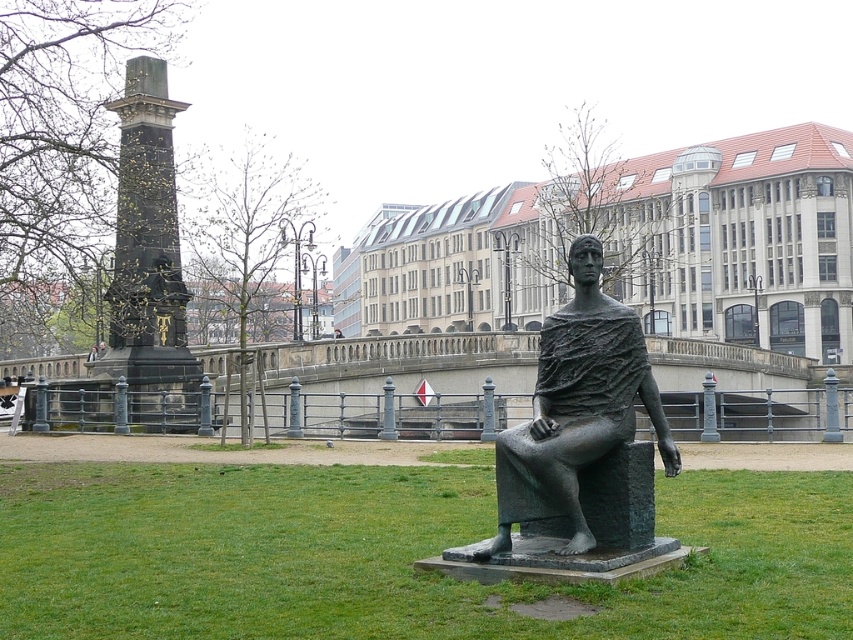
Based on the photo, which is above, green grass at lower center or bronze/statue at center?

Positioned higher is bronze/statue at center.

Which is more to the right, green grass at lower center or bronze/statue at center?

bronze/statue at center

Is point (161, 580) behind point (628, 435)?

No, it is not.

Where is `green grass at lower center`? green grass at lower center is located at coordinates (392, 554).

Can you confirm if green grass at lower center is wider than dark brown stone column at left?

Indeed, green grass at lower center has a greater width compared to dark brown stone column at left.

Is green grass at lower center positioned behind dark brown stone column at left?

No.

Locate an element on the screen. This screenshot has width=853, height=640. green grass at lower center is located at coordinates (392, 554).

Which is above, bronze/statue at center or dark brown stone column at left?

dark brown stone column at left is higher up.

Who is shorter, bronze/statue at center or dark brown stone column at left?

bronze/statue at center

You are a GUI agent. You are given a task and a screenshot of the screen. Output one action in this format:
    pyautogui.click(x=<x>, y=<y>)
    Task: Click on the bronze/statue at center
    
    Given the screenshot: What is the action you would take?
    pyautogui.click(x=581, y=440)

Where is `bronze/statue at center`? Image resolution: width=853 pixels, height=640 pixels. bronze/statue at center is located at coordinates (581, 440).